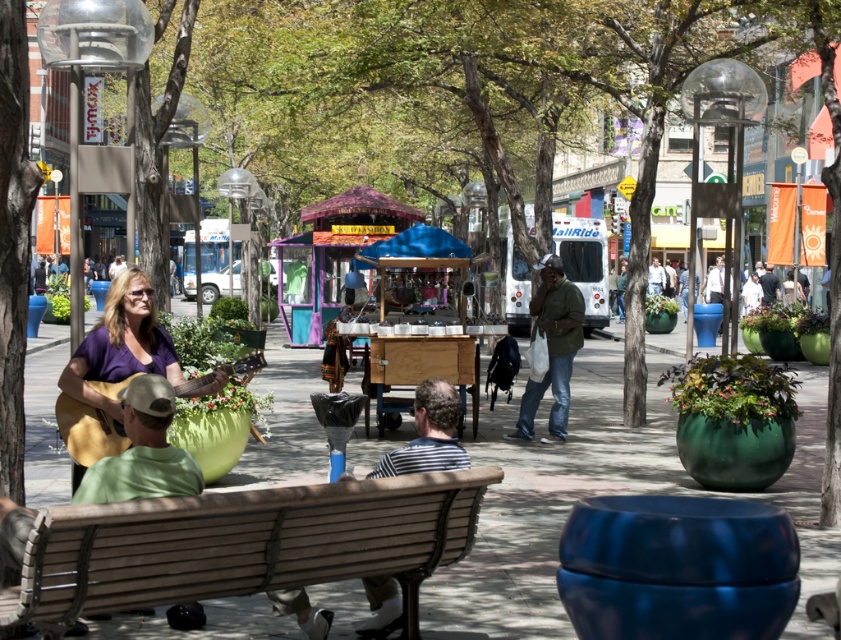
Is green fabric hat at center to the left of wooden acoustic guitar at lower left from the viewer's perspective?

Incorrect, green fabric hat at center is not on the left side of wooden acoustic guitar at lower left.

Between point (175, 605) and point (67, 442), which one is positioned behind?

The point (175, 605) is behind.

Locate an element on the screen. green fabric hat at center is located at coordinates (141, 451).

The width and height of the screenshot is (841, 640). In order to click on green fabric hat at center in this screenshot , I will do `click(141, 451)`.

Between matte purple shirt at center and wooden acoustic guitar at lower left, which one is positioned lower?

Positioned lower is wooden acoustic guitar at lower left.

Can you confirm if matte purple shirt at center is bigger than wooden acoustic guitar at lower left?

Correct, matte purple shirt at center is larger in size than wooden acoustic guitar at lower left.

Does point (115, 403) come in front of point (244, 374)?

Yes.

The image size is (841, 640). Find the location of `matte purple shirt at center`. matte purple shirt at center is located at coordinates (120, 344).

Can you confirm if matte purple shirt at center is shorter than light brown leather jacket at center?

Yes, matte purple shirt at center is shorter than light brown leather jacket at center.

This screenshot has width=841, height=640. Describe the element at coordinates (120, 344) in the screenshot. I see `matte purple shirt at center` at that location.

Where is `matte purple shirt at center`? The width and height of the screenshot is (841, 640). matte purple shirt at center is located at coordinates (120, 344).